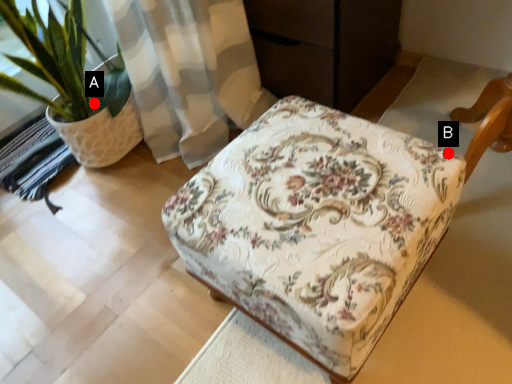
Question: Two points are circled on the image, labeled by A and B beside each circle. Which point is further to the camera?

Choices:
 (A) A is further
 (B) B is further

Answer: (A)